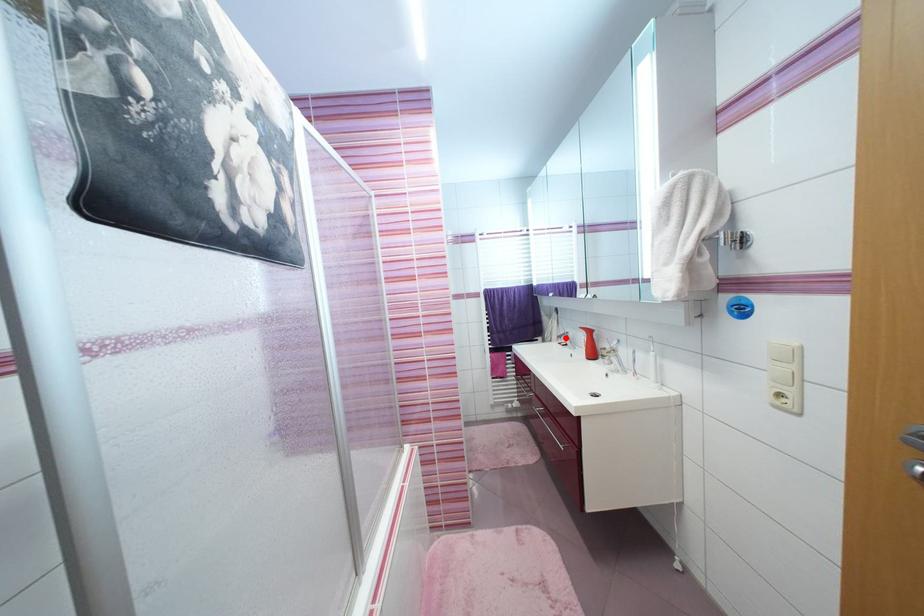
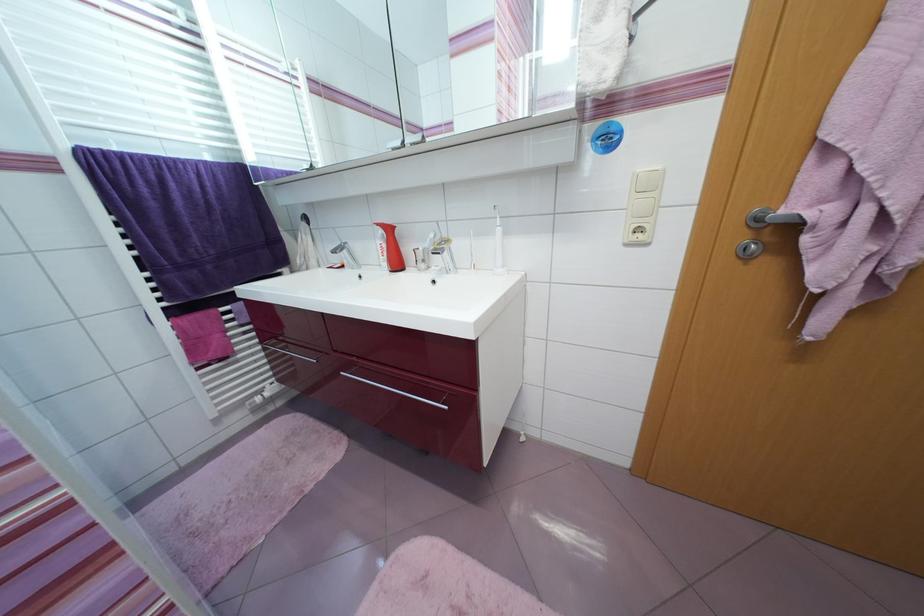
The point at the highlighted location is marked in the first image. Where is the corresponding point in the second image?

(338, 254)